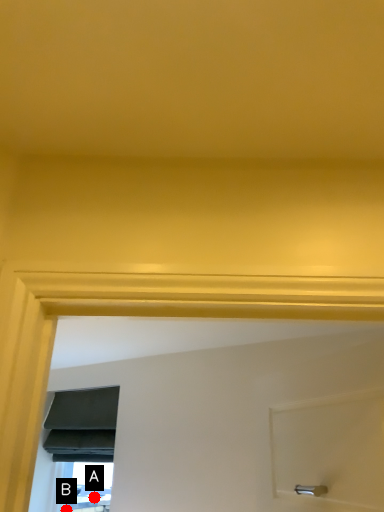
Question: Two points are circled on the image, labeled by A and B beside each circle. Which point appears closest to the camera in this image?

Choices:
 (A) A is closer
 (B) B is closer

Answer: (A)